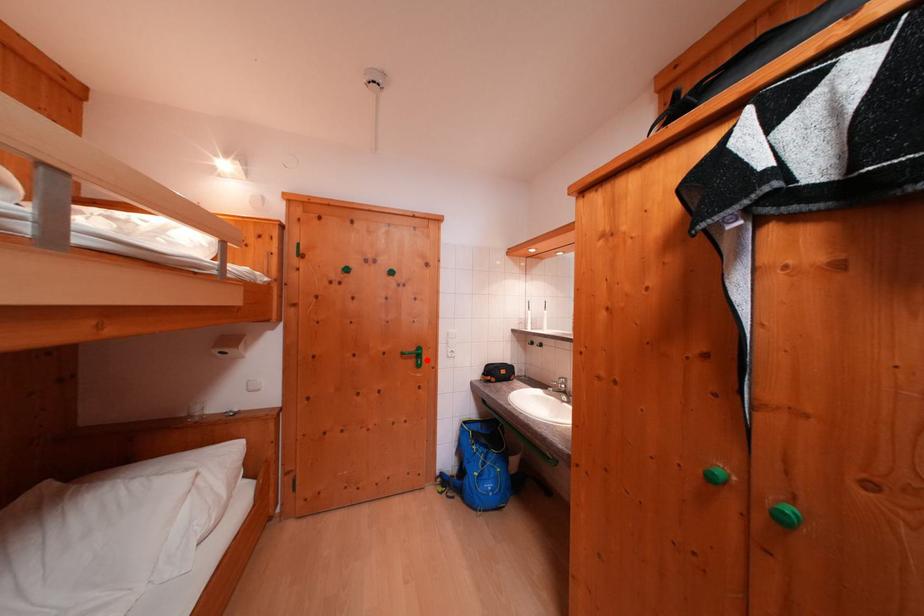
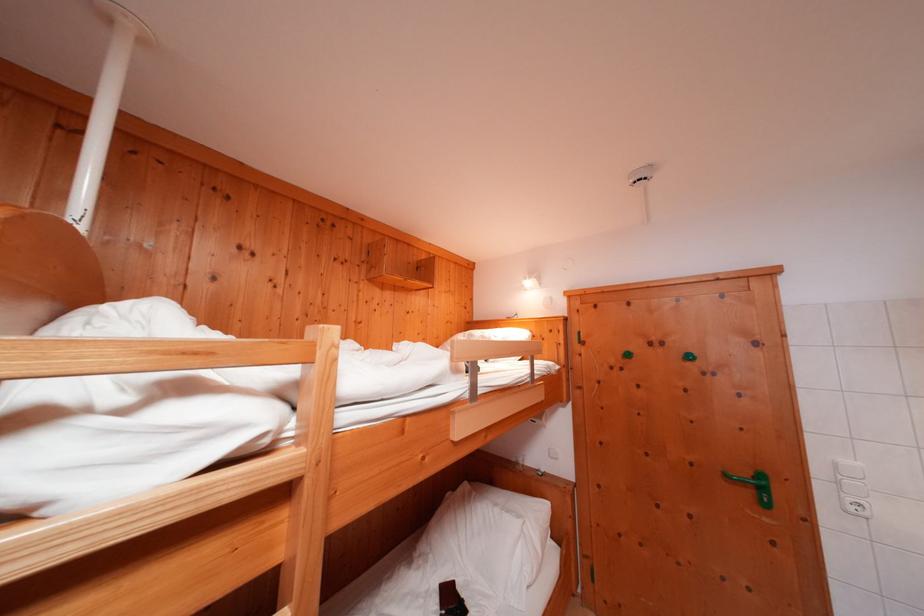
Locate, in the second image, the point that corresponds to the highlighted location in the first image.

(771, 493)